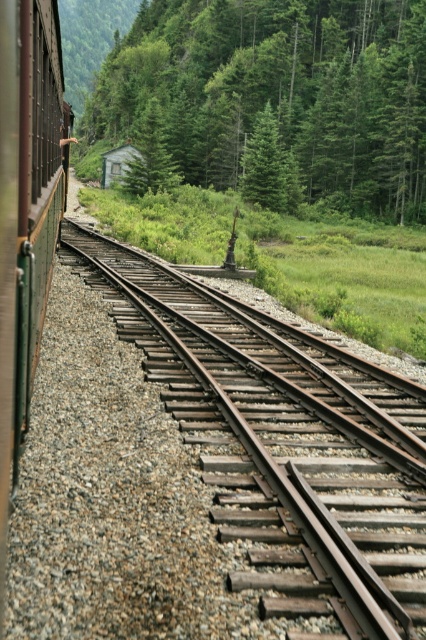
Is rusty metal train track at center taller than green glass window at left?

In fact, rusty metal train track at center may be shorter than green glass window at left.

Between rusty metal train track at center and green glass window at left, which one is positioned higher?

Positioned higher is green glass window at left.

This screenshot has height=640, width=426. I want to click on rusty metal train track at center, so click(284, 444).

Between green matte train car at left and green glass window at left, which one has more height?

green matte train car at left

Between green matte train car at left and green glass window at left, which one has less height?

green glass window at left is shorter.

Between point (16, 65) and point (60, 163), which one is positioned behind?

Point (60, 163)

This screenshot has width=426, height=640. I want to click on green matte train car at left, so click(x=26, y=212).

Image resolution: width=426 pixels, height=640 pixels. What do you see at coordinates (284, 444) in the screenshot?
I see `rusty metal train track at center` at bounding box center [284, 444].

Can you confirm if rusty metal train track at center is bigger than green matte train car at left?

No, rusty metal train track at center is not bigger than green matte train car at left.

At what (x,y) coordinates should I click in order to perform the action: click on rusty metal train track at center. Please return your answer as a coordinate pair (x, y). The width and height of the screenshot is (426, 640). Looking at the image, I should click on (284, 444).